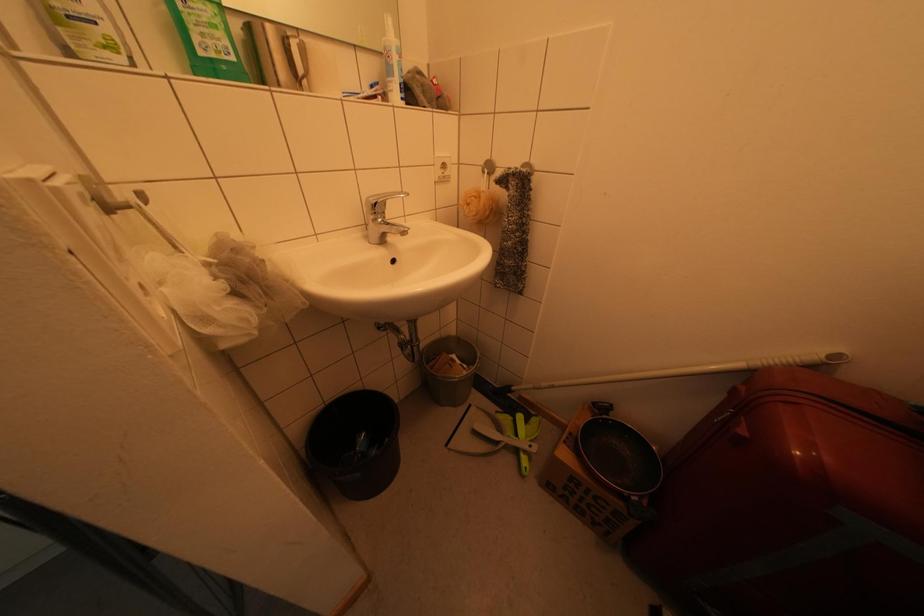
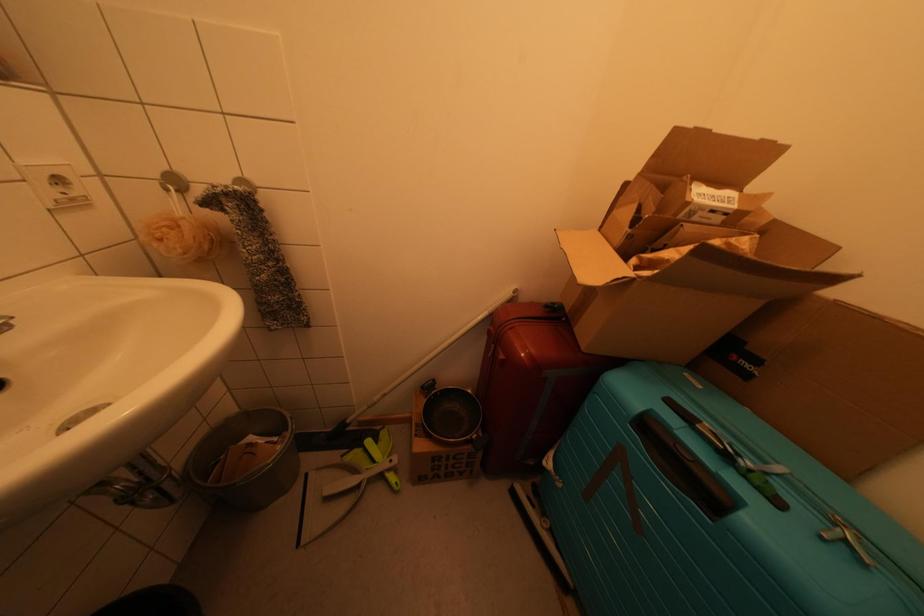
Question: The camera is either moving clockwise (left) or counter-clockwise (right) around the object. The first image is from the beginning of the video and the second image is from the end. Is the camera moving left or right when shooting the video?

Choices:
 (A) Left
 (B) Right

Answer: (A)